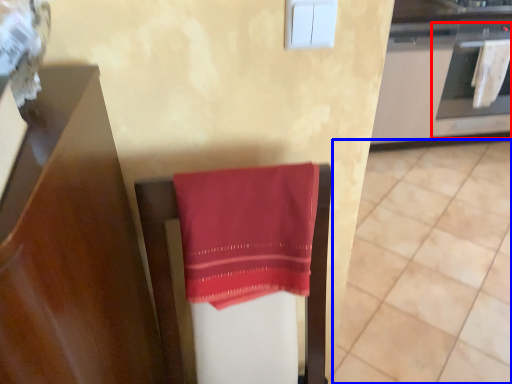
Question: Which object appears closest to the camera in this image, oven (highlighted by a red box) or tile (highlighted by a blue box)?

Choices:
 (A) oven
 (B) tile

Answer: (B)